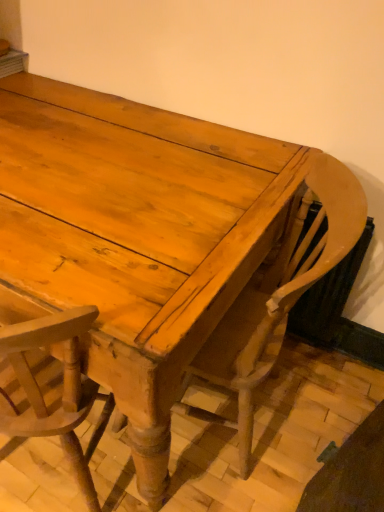
You are a GUI agent. You are given a task and a screenshot of the screen. Output one action in this format:
    pyautogui.click(x=<x>, y=<y>)
    Task: Click on the matte wood table at center
    
    Given the screenshot: What is the action you would take?
    pyautogui.click(x=134, y=236)

This screenshot has width=384, height=512. What do you see at coordinates (134, 236) in the screenshot?
I see `matte wood table at center` at bounding box center [134, 236].

Locate an element on the screen. This screenshot has width=384, height=512. matte wood table at center is located at coordinates (134, 236).